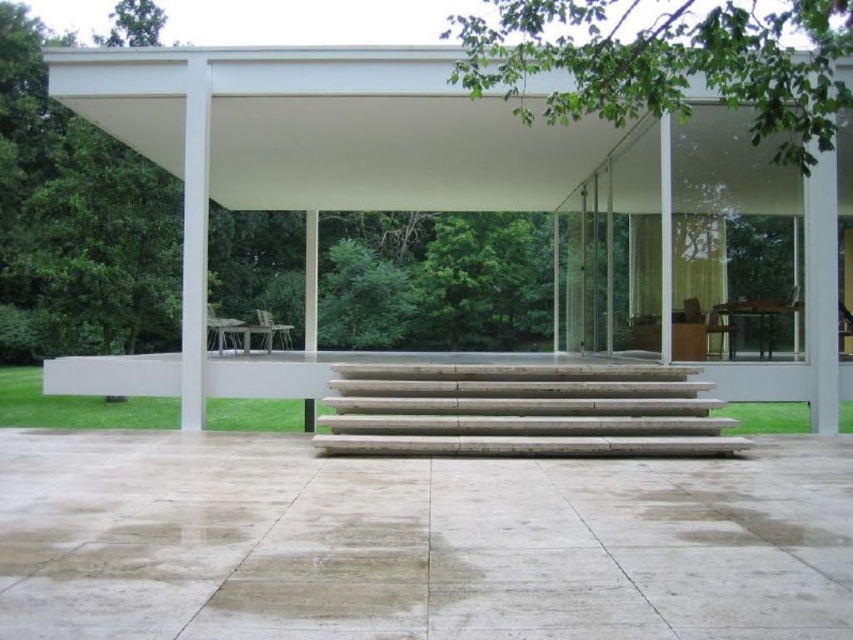
Is white matte canopy at upper center to the left of white marble stairs at center from the viewer's perspective?

Yes, white matte canopy at upper center is to the left of white marble stairs at center.

Which is more to the left, white matte canopy at upper center or white marble stairs at center?

From the viewer's perspective, white matte canopy at upper center appears more on the left side.

Between point (410, 145) and point (422, 387), which one is positioned behind?

The point (410, 145) is more distant.

Find the location of a particular element. The height and width of the screenshot is (640, 853). white matte canopy at upper center is located at coordinates (334, 128).

Is the position of smooth concrete steps at center less distant than that of white matte canopy at upper center?

Yes, smooth concrete steps at center is closer to the viewer.

Between smooth concrete steps at center and white matte canopy at upper center, which one has less height?

Standing shorter between the two is smooth concrete steps at center.

What do you see at coordinates (416, 541) in the screenshot? I see `smooth concrete steps at center` at bounding box center [416, 541].

The image size is (853, 640). Identify the location of smooth concrete steps at center. (416, 541).

Can you confirm if smooth concrete steps at center is positioned below white marble stairs at center?

Yes.

Which is more to the right, smooth concrete steps at center or white marble stairs at center?

From the viewer's perspective, white marble stairs at center appears more on the right side.

Does point (454, 525) come farther from viewer compared to point (463, 369)?

No, (454, 525) is closer to viewer.

The height and width of the screenshot is (640, 853). What are the coordinates of `smooth concrete steps at center` in the screenshot? It's located at (416, 541).